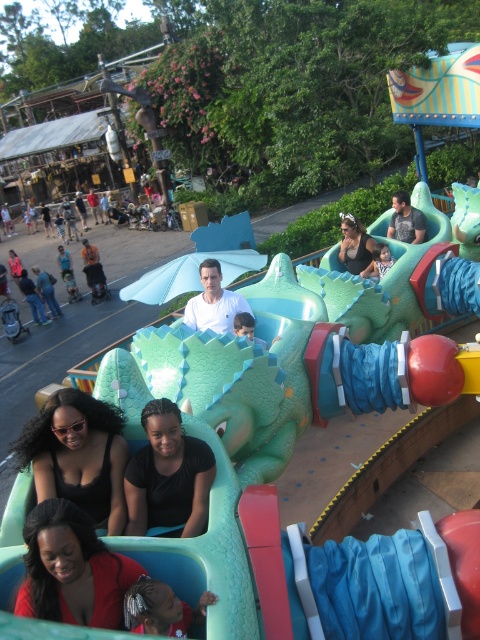
You are a photographer at the theme park and want to take a photo of the two people wearing the matte black tank top at center and the matte blue shirt at center. Which one is positioned more to the right?

The matte black tank top at center is positioned to the right of the matte blue shirt at center, so the matte black tank top at center is more to the right.

You are a photographer standing in front of the dragon ride at the theme park. You notice two people wearing a black matte shirt at center and a matte blue shirt at center. Which shirt is smaller in size?

The black matte shirt at center is smaller than the matte blue shirt at center.

You are standing in front of the dragon ride and want to determine which of the two points, point (199, 506) or point (38, 284), is nearer to you. Based on the scene, which point is closer?

Point (199, 506) is closer to the viewer than point (38, 284).